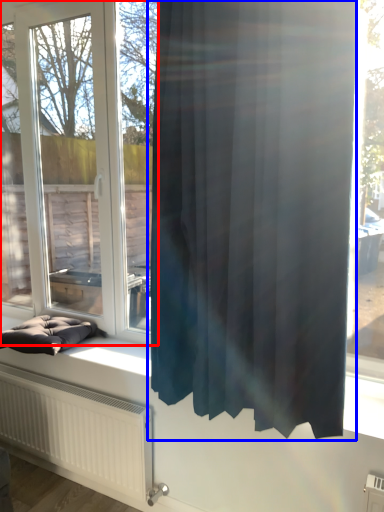
Question: Which of the following is the closest to the observer, window (highlighted by a red box) or curtain (highlighted by a blue box)?

Choices:
 (A) window
 (B) curtain

Answer: (B)